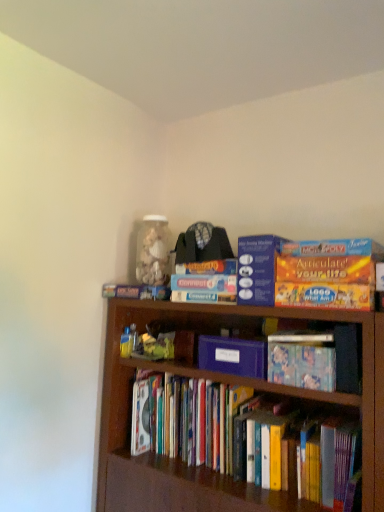
Question: Is orange matte board game at upper center, which appears as the second paperback book when ordered from the bottom, shorter than hardcover book at center, the 2th book positioned from the bottom?

Choices:
 (A) yes
 (B) no

Answer: (B)

Question: Is orange matte board game at upper center, positioned as the 1th paperback book in top-to-bottom order, wider than hardcover book at center, the 2th book positioned from the bottom?

Choices:
 (A) yes
 (B) no

Answer: (A)

Question: From a real-world perspective, is orange matte board game at upper center, which appears as the second paperback book when ordered from the bottom, positioned under hardcover book at center, the 2th book positioned from the bottom, based on gravity?

Choices:
 (A) no
 (B) yes

Answer: (A)

Question: Is orange matte board game at upper center, which appears as the second paperback book when ordered from the bottom, behind hardcover book at center, the 2th book positioned from the bottom?

Choices:
 (A) no
 (B) yes

Answer: (B)

Question: Can you confirm if orange matte board game at upper center, which appears as the second paperback book when ordered from the bottom, is smaller than hardcover book at center, which appears as the 2th book when viewed from the top?

Choices:
 (A) yes
 (B) no

Answer: (B)

Question: Looking at their shapes, would you say hardcover books at center, which ranks as the 1th book in bottom-to-top order, is wider or thinner than purple matte paper at center, which ranks as the second paperback book in top-to-bottom order?

Choices:
 (A) wide
 (B) thin

Answer: (A)

Question: From the image's perspective, is hardcover books at center, placed as the third book when sorted from top to bottom, above or below purple matte paper at center, which ranks as the second paperback book in top-to-bottom order?

Choices:
 (A) below
 (B) above

Answer: (A)

Question: From a real-world perspective, is hardcover books at center, which ranks as the 1th book in bottom-to-top order, above or below purple matte paper at center, marked as the 1th paperback book in a bottom-to-top arrangement?

Choices:
 (A) below
 (B) above

Answer: (A)

Question: Considering their positions, is hardcover books at center, placed as the third book when sorted from top to bottom, located in front of or behind purple matte paper at center, marked as the 1th paperback book in a bottom-to-top arrangement?

Choices:
 (A) front
 (B) behind

Answer: (A)

Question: In terms of size, does hardcover books at center, which ranks as the 1th book in bottom-to-top order, appear bigger or smaller than hardcover book at center, which appears as the 2th book when viewed from the top?

Choices:
 (A) small
 (B) big

Answer: (B)

Question: Considering the positions of hardcover books at center, placed as the third book when sorted from top to bottom, and hardcover book at center, the 2th book positioned from the bottom, in the image, is hardcover books at center, placed as the third book when sorted from top to bottom, taller or shorter than hardcover book at center, the 2th book positioned from the bottom,?

Choices:
 (A) short
 (B) tall

Answer: (B)

Question: Is hardcover books at center, placed as the third book when sorted from top to bottom, wider or thinner than hardcover book at center, which appears as the 2th book when viewed from the top?

Choices:
 (A) thin
 (B) wide

Answer: (B)

Question: Is point (306, 455) positioned closer to the camera than point (269, 379)?

Choices:
 (A) closer
 (B) farther

Answer: (B)

Question: Is hardcover books at center, placed as the third book when sorted from top to bottom, taller or shorter than blue cardboard connect 4 game at upper center, which is the 1th book in top-to-bottom order?

Choices:
 (A) short
 (B) tall

Answer: (B)

Question: From the image's perspective, is hardcover books at center, which ranks as the 1th book in bottom-to-top order, positioned above or below blue cardboard connect 4 game at upper center, arranged as the third book when ordered from the bottom?

Choices:
 (A) above
 (B) below

Answer: (B)